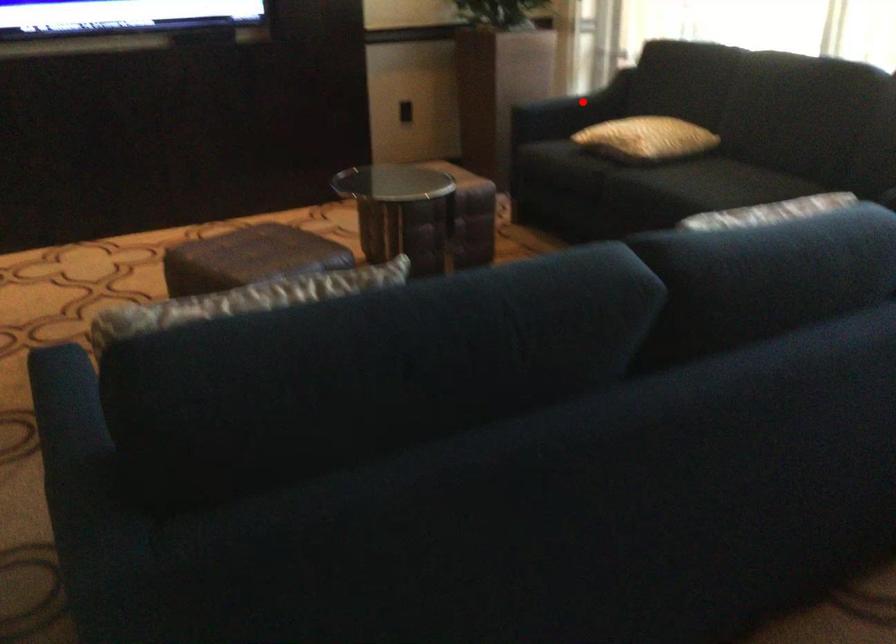
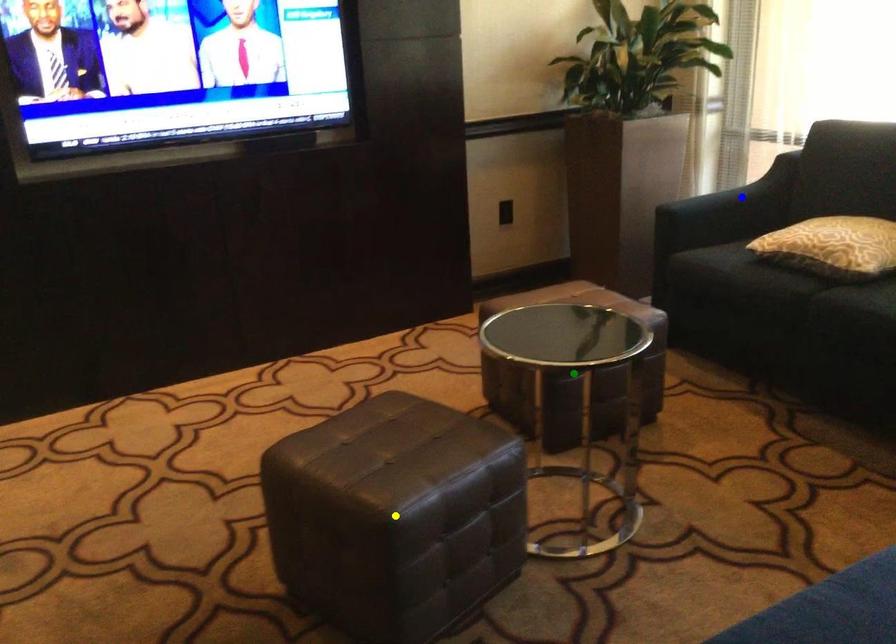
Question: I am providing you with two images of the same scene from different viewpoints. A red point is marked on the first image. You are given multiple points on the second image. Which point in image 2 is actually the same real-world point as the red point in image 1?

Choices:
 (A) green point
 (B) blue point
 (C) yellow point

Answer: (B)